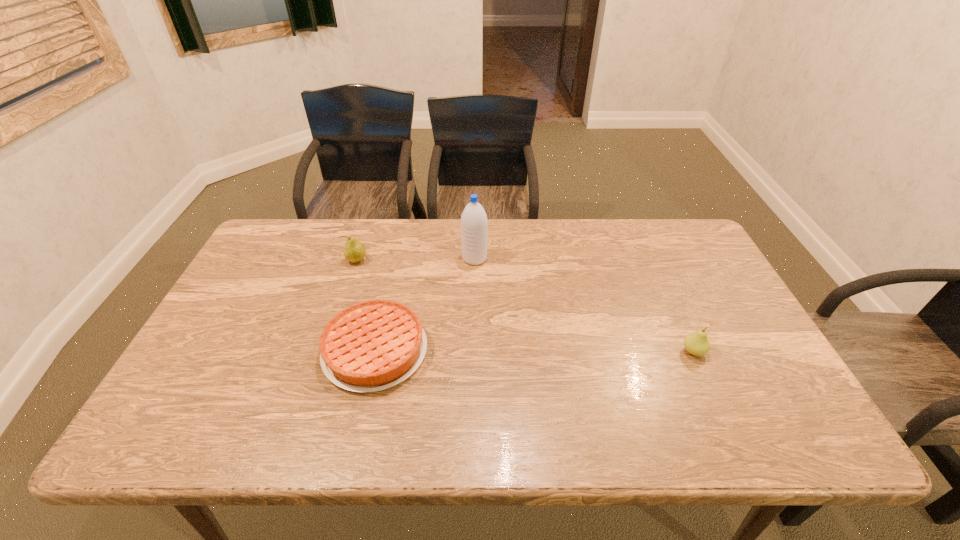
I want to click on vacant area in the image that satisfies the following two spatial constraints: 1. on the front side of the nearer pear; 2. on the right side of the second object from right to left, so click(473, 352).

Where is `vacant space that satisfies the following two spatial constraints: 1. on the front side of the left pear; 2. on the right side of the nearer pear`? This screenshot has height=540, width=960. vacant space that satisfies the following two spatial constraints: 1. on the front side of the left pear; 2. on the right side of the nearer pear is located at coordinates (326, 352).

Where is `vacant region that satisfies the following two spatial constraints: 1. on the front side of the rightmost object; 2. on the right side of the farther pear`? This screenshot has height=540, width=960. vacant region that satisfies the following two spatial constraints: 1. on the front side of the rightmost object; 2. on the right side of the farther pear is located at coordinates (326, 352).

This screenshot has height=540, width=960. Identify the location of vacant position in the image that satisfies the following two spatial constraints: 1. on the back side of the third object from left to right; 2. on the right side of the pie. (396, 259).